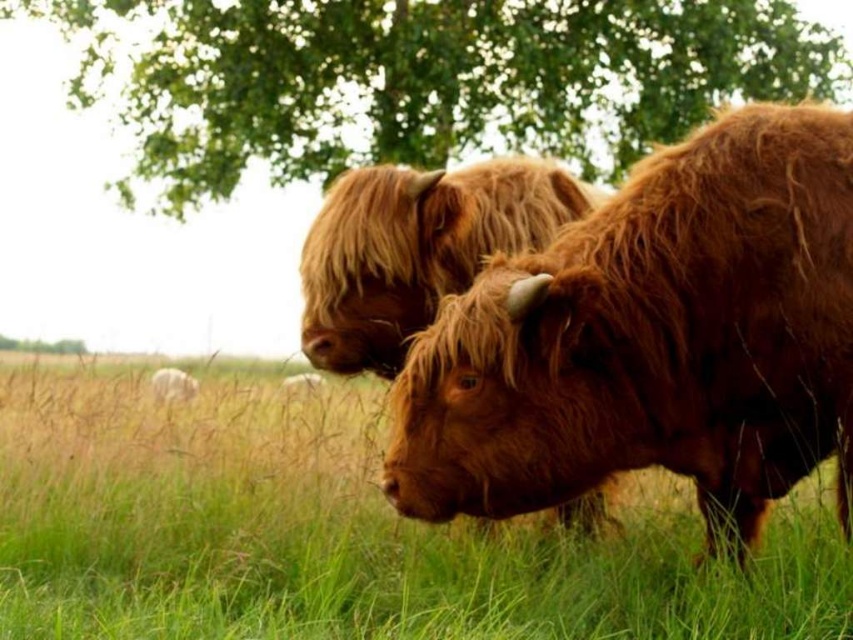
You are standing at the point marked by point (x=343, y=529) in the image. What is directly below you in the scene?

The point (x=343, y=529) marks green grassy at center, so directly below you is the green grassy area at the center of the scene.